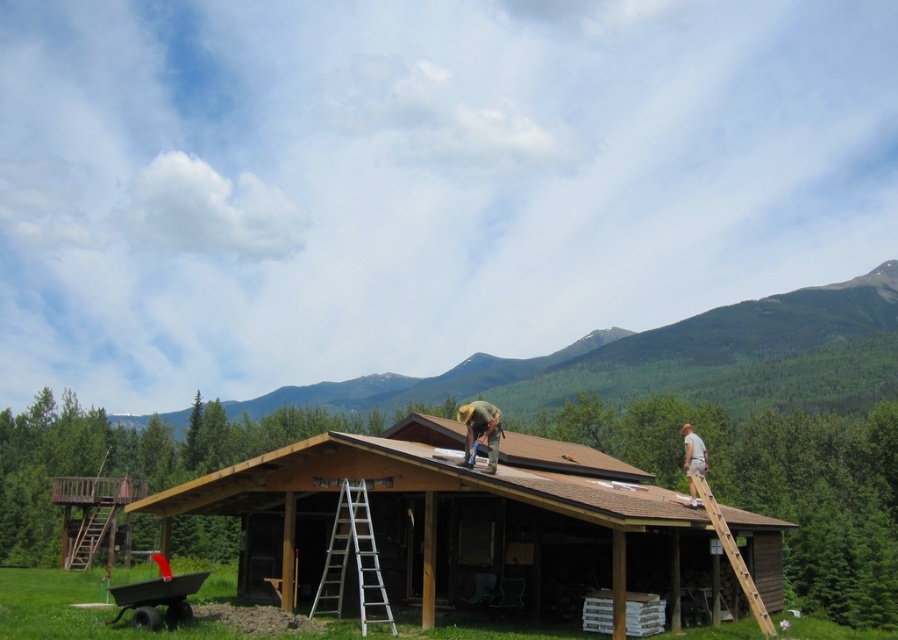
Who is positioned more to the right, green fabric construction worker at center or green fabric shirt at upper right?

green fabric shirt at upper right is more to the right.

Can you confirm if green fabric construction worker at center is wider than green fabric shirt at upper right?

No.

Does point (486, 406) come closer to viewer compared to point (694, 506)?

Yes, it is in front of point (694, 506).

This screenshot has height=640, width=898. Find the location of `green fabric construction worker at center`. green fabric construction worker at center is located at coordinates (481, 429).

Is point (634, 582) closer to viewer compared to point (302, 492)?

No, (634, 582) is behind (302, 492).

What are the coordinates of `brown wooden cabin at center` in the screenshot? It's located at (481, 522).

Is brown wooden roof at center behind green fabric construction worker at center?

No, it is not.

Does brown wooden roof at center have a larger size compared to green fabric construction worker at center?

Indeed, brown wooden roof at center has a larger size compared to green fabric construction worker at center.

Describe the element at coordinates (433, 477) in the screenshot. I see `brown wooden roof at center` at that location.

At what (x,y) coordinates should I click in order to perform the action: click on brown wooden roof at center. Please return your answer as a coordinate pair (x, y). The width and height of the screenshot is (898, 640). Looking at the image, I should click on (433, 477).